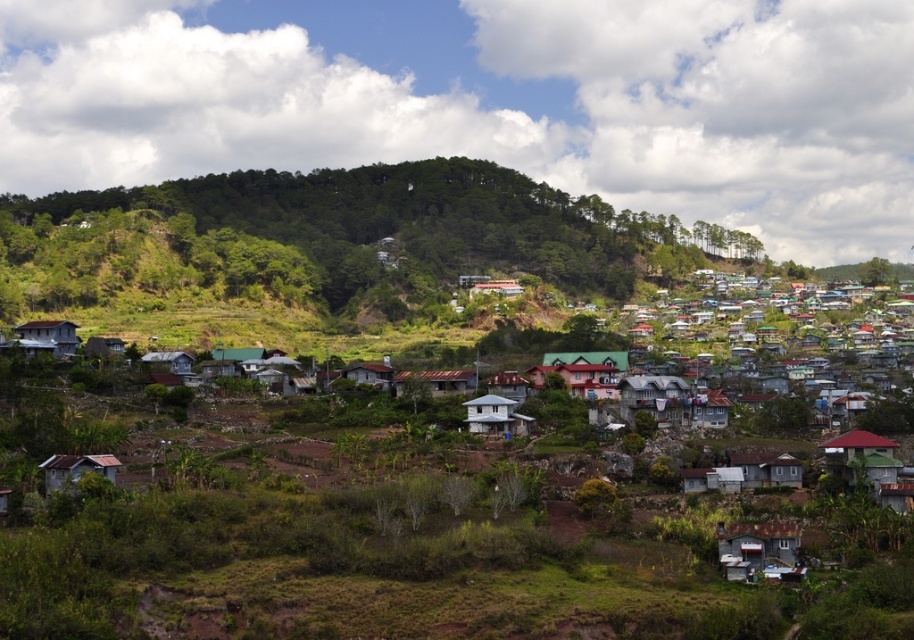
You are standing on the wooden shingle hut at lower left and want to visit the light blue wooden hut at center. Which direction should you move to reach it?

The wooden shingle hut at lower left is located above the light blue wooden hut at center, so you should move downward to reach it.

You are standing at the bottom of the hill looking up at the settlement. Which direction should you walk to reach the white matte house at center?

Since the white matte house at center is located at point coordinates of 0.652 on the x axis and 0.543 on the y axis, you should walk towards the upper right direction to reach it.

You are standing at the top of the hill overlooking the village. You see the wooden shingle hut at lower left and the light blue wooden hut at center. Which one is positioned to the left when viewed from your vantage point?

The wooden shingle hut at lower left is positioned to the left of the light blue wooden hut at center when viewed from your vantage point at the top of the hill.